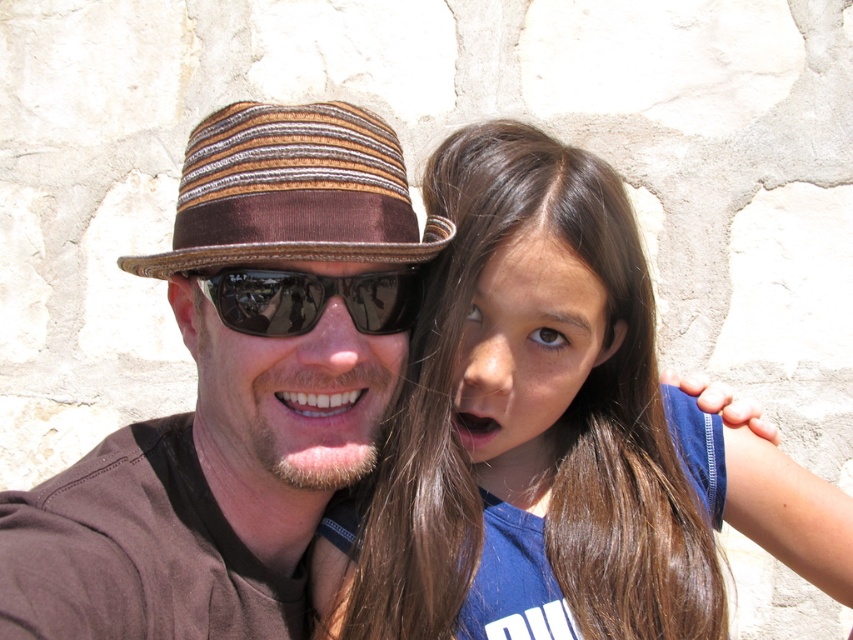
Question: Which object appears farthest from the camera in this image?

Choices:
 (A) black reflective sunglasses at center
 (B) brown striped fabric fedora at upper center
 (C) brown hair at center

Answer: (C)

Question: Can you confirm if brown hair at center is smaller than black reflective sunglasses at center?

Choices:
 (A) no
 (B) yes

Answer: (A)

Question: Which of the following is the farthest from the observer?

Choices:
 (A) brown striped fabric fedora at upper center
 (B) black reflective sunglasses at center

Answer: (B)

Question: Where is brown hair at center located in relation to brown striped fabric fedora at upper center in the image?

Choices:
 (A) below
 (B) above

Answer: (A)

Question: Considering the real-world distances, which object is closest to the brown hair at center?

Choices:
 (A) brown striped fabric fedora at upper center
 (B) black reflective sunglasses at center

Answer: (A)

Question: Is brown hair at center closer to camera compared to brown corduroy hat at center?

Choices:
 (A) no
 (B) yes

Answer: (A)